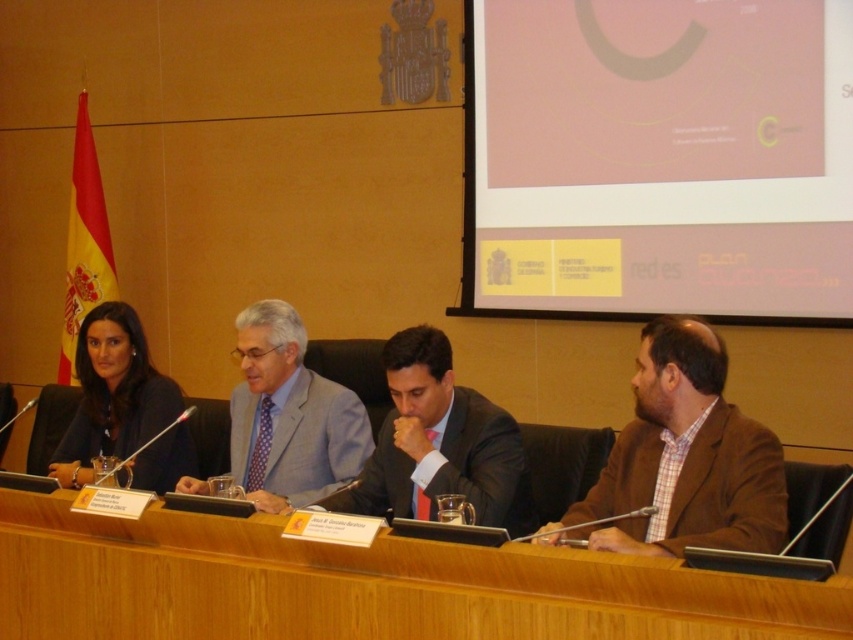
Question: Which of the following is the closest to the observer?

Choices:
 (A) matte black suit at center
 (B) wooden at center
 (C) brown plaid shirt at right
 (D) matte black suit at left

Answer: (B)

Question: Among these objects, which one is nearest to the camera?

Choices:
 (A) matte black suit at left
 (B) wooden at center
 (C) matte gray suit at center
 (D) brown plaid shirt at right

Answer: (B)

Question: Estimate the real-world distances between objects in this image. Which object is farther from the wooden at center?

Choices:
 (A) matte gray suit at center
 (B) matte black suit at left

Answer: (B)

Question: Where is wooden at center located in relation to matte black suit at center in the image?

Choices:
 (A) right
 (B) left

Answer: (B)

Question: Does wooden at center have a larger size compared to brown plaid shirt at right?

Choices:
 (A) yes
 (B) no

Answer: (A)

Question: Is brown plaid shirt at right positioned before matte black suit at center?

Choices:
 (A) no
 (B) yes

Answer: (B)